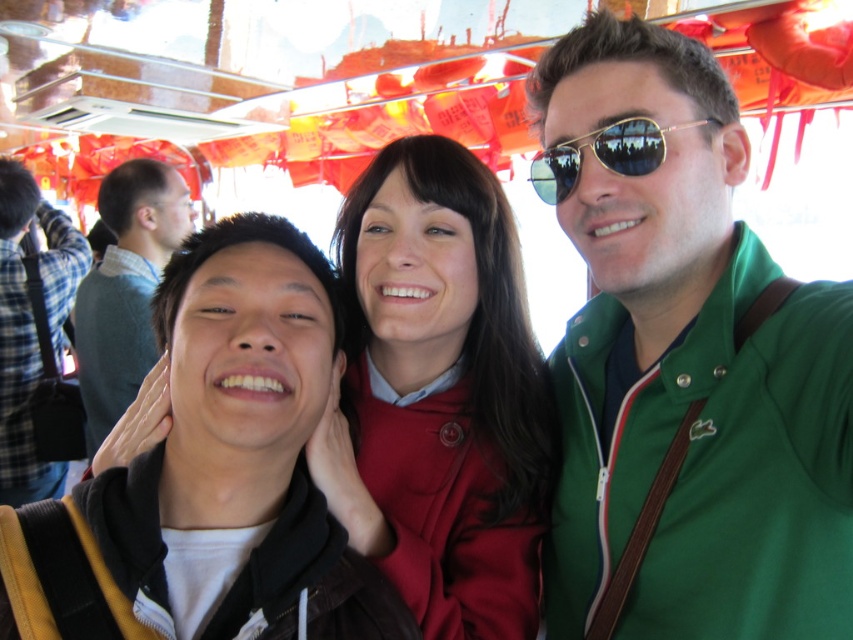
You are trying to decide which item to place in a small pouch that can only hold items smaller than the gold reflective sunglasses at center. Can the green fabric jacket at center fit into the pouch?

The green fabric jacket at center is bigger than the gold reflective sunglasses at center, so it cannot fit into the pouch designed for items smaller than the gold reflective sunglasses at center.

You are standing in front of a bus and want to take a selfie with your friends. The camera you are using has a focal length of 35mm. If the point at coordinates point (579,333) in the image corresponds to a real distance of 4.09 feet from the camera, can you estimate how far you should stand from the camera to ensure everyone is in frame?

The point at coordinates point (579,333) is 4.09 feet from the camera. To ensure everyone is in frame, you should stand at least 4.09 feet away from the camera.

Where is the green fabric jacket at center located in the image?

The green fabric jacket at center is located at point coordinates of 0.570 on the x axis and 0.803 on the y axis.